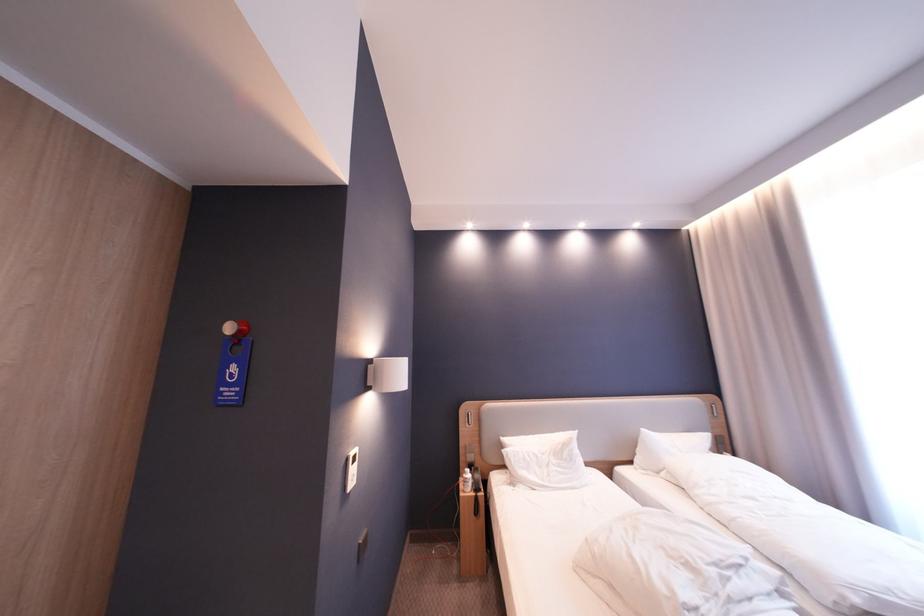
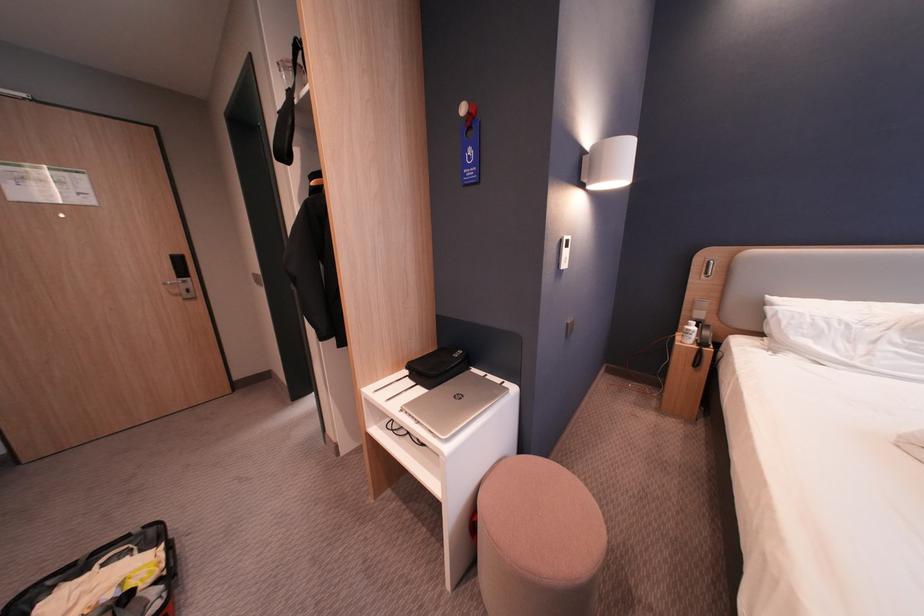
Find the pixel in the second image that matches (233,390) in the first image.

(477, 172)